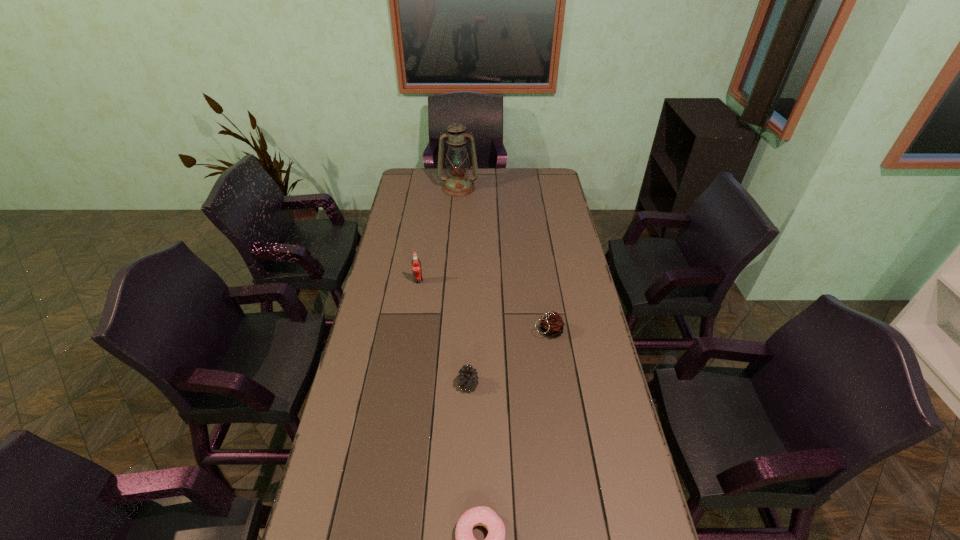
You are a GUI agent. You are given a task and a screenshot of the screen. Output one action in this format:
    pyautogui.click(x=<x>, y=<y>)
    Task: Click on the farthest object
    This screenshot has width=960, height=540.
    Given the screenshot: What is the action you would take?
    pyautogui.click(x=458, y=184)

I want to click on the tallest object, so (458, 184).

Identify the location of the fourth shortest object. tap(416, 264).

Image resolution: width=960 pixels, height=540 pixels. I want to click on soda bottle, so click(416, 264).

Where is `the farther pinecone`? The width and height of the screenshot is (960, 540). the farther pinecone is located at coordinates (552, 324).

Locate an element on the screen. Image resolution: width=960 pixels, height=540 pixels. the third nearest object is located at coordinates (552, 324).

Identify the location of the second nearest object. (468, 377).

You are a GUI agent. You are given a task and a screenshot of the screen. Output one action in this format:
    pyautogui.click(x=<x>, y=<y>)
    Task: Click on the nearer pinecone
    The image size is (960, 540).
    Given the screenshot: What is the action you would take?
    pyautogui.click(x=468, y=377)

The width and height of the screenshot is (960, 540). What are the coordinates of `free location located 0.250m on the front of the farthest object` in the screenshot? It's located at [x=456, y=226].

Where is `vacant area situated on the label of the soda bottle`? vacant area situated on the label of the soda bottle is located at coordinates (414, 313).